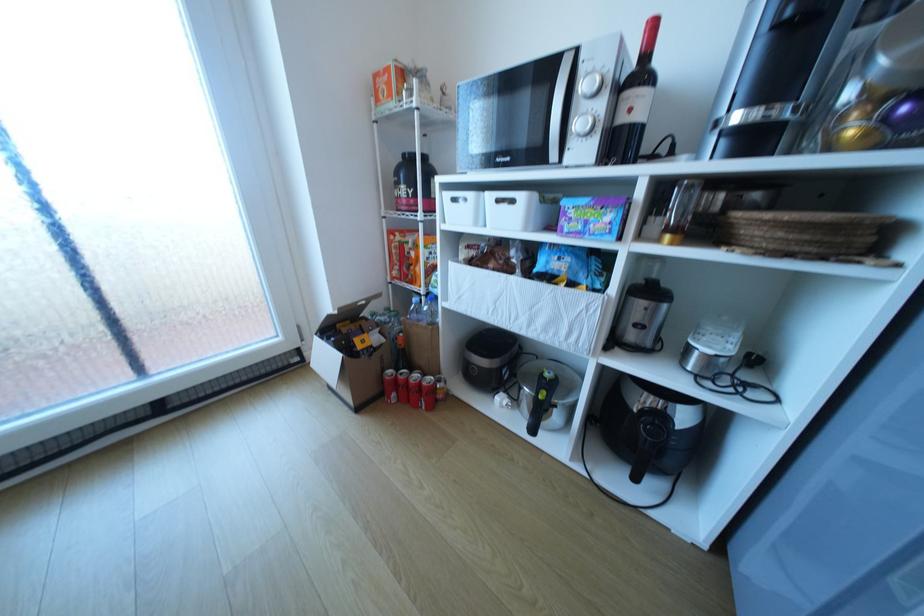
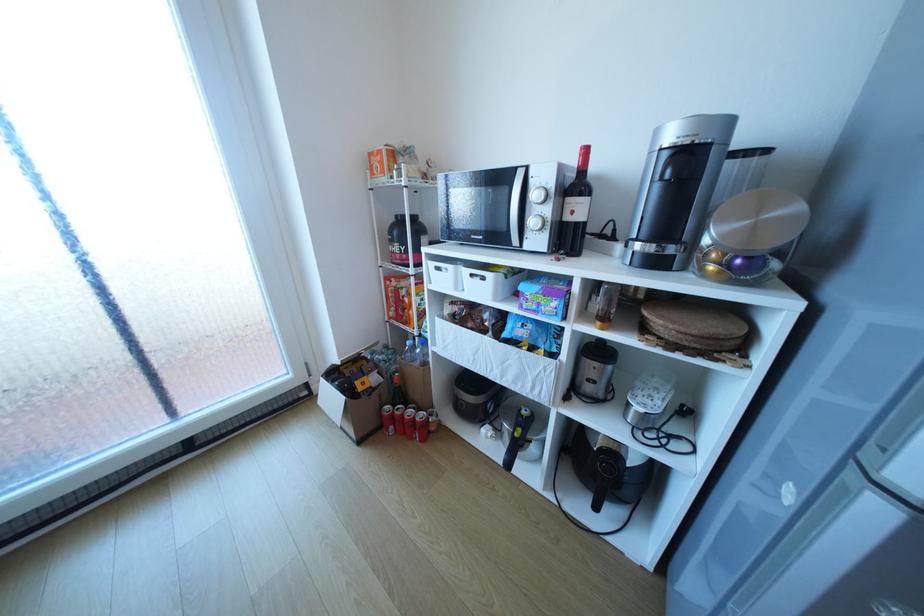
The point at (587, 124) is marked in the first image. Where is the corresponding point in the second image?

(541, 222)